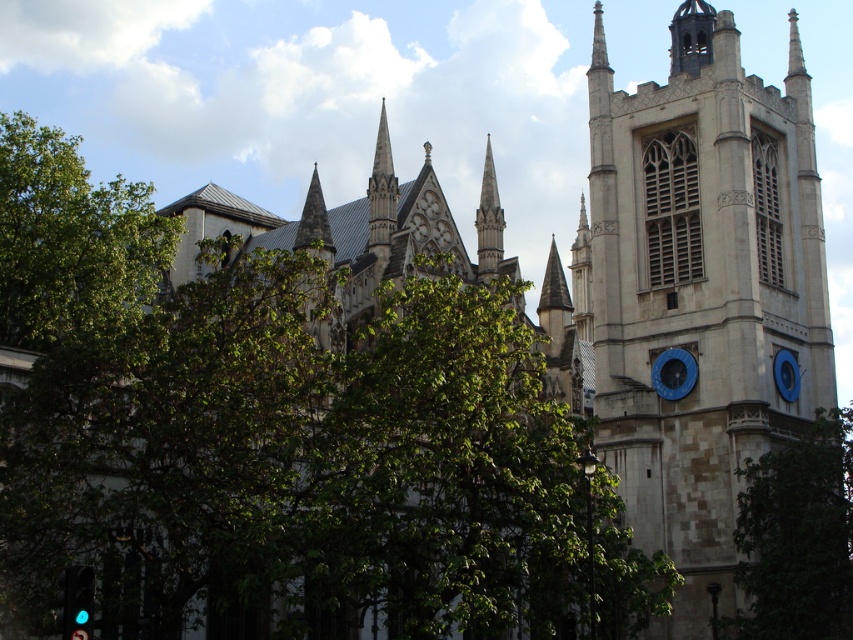
Question: Does green glass traffic light at lower left have a lesser width compared to blue metallic clock at upper right?

Choices:
 (A) no
 (B) yes

Answer: (A)

Question: Is green glass traffic light at lower left to the left of blue metallic clock at upper right from the viewer's perspective?

Choices:
 (A) no
 (B) yes

Answer: (B)

Question: Does stone clock tower at upper right appear on the left side of blue metallic clock at upper right?

Choices:
 (A) yes
 (B) no

Answer: (A)

Question: Which object appears closest to the camera in this image?

Choices:
 (A) green leafy tree at right
 (B) stone clock tower at upper right
 (C) blue metallic clock at upper right
 (D) green glass traffic light at lower left

Answer: (D)

Question: Which of the following is the farthest from the observer?

Choices:
 (A) (804, 88)
 (B) (786, 468)

Answer: (A)

Question: Which object is closer to the camera taking this photo?

Choices:
 (A) blue metallic clock at upper right
 (B) stone clock tower at upper right
 (C) blue painted metal clock at right

Answer: (B)